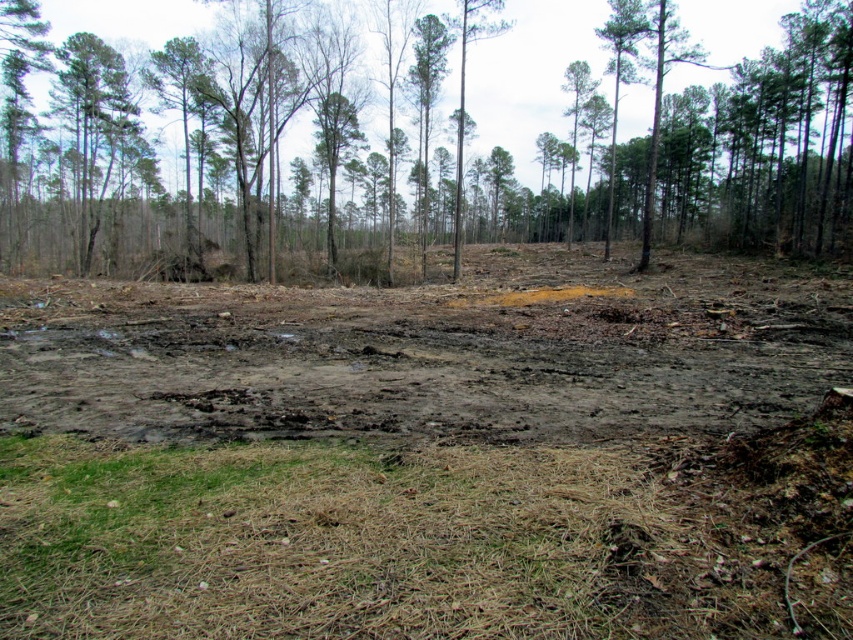
Who is more distant from viewer, (x=138, y=557) or (x=106, y=88)?

The point (x=106, y=88) is more distant.

The image size is (853, 640). What do you see at coordinates (422, 451) in the screenshot?
I see `brown muddy field at center` at bounding box center [422, 451].

This screenshot has height=640, width=853. I want to click on brown muddy field at center, so click(422, 451).